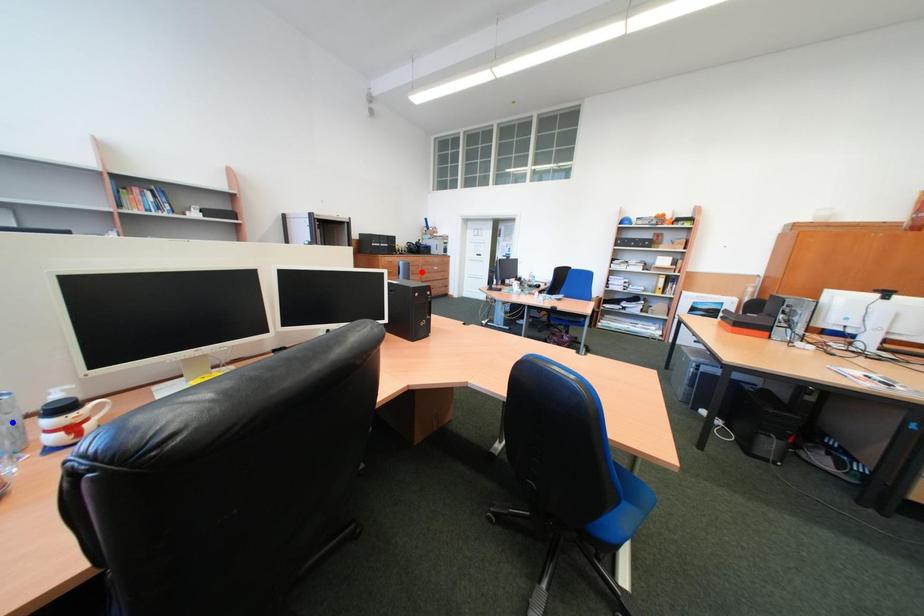
Question: In the image, two points are highlighted. Which point is nearer to the camera? Reply with the corresponding letter.

Choices:
 (A) blue point
 (B) red point

Answer: (A)